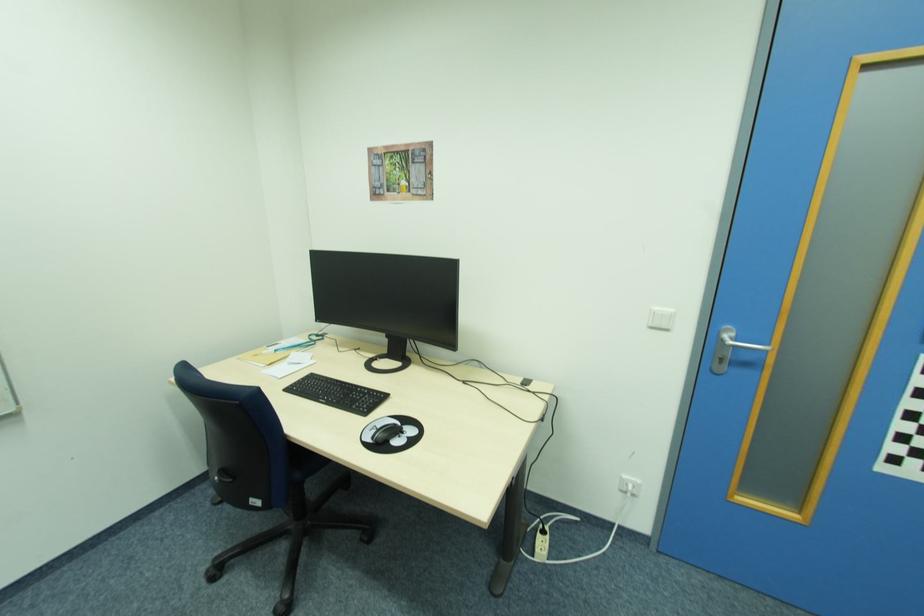
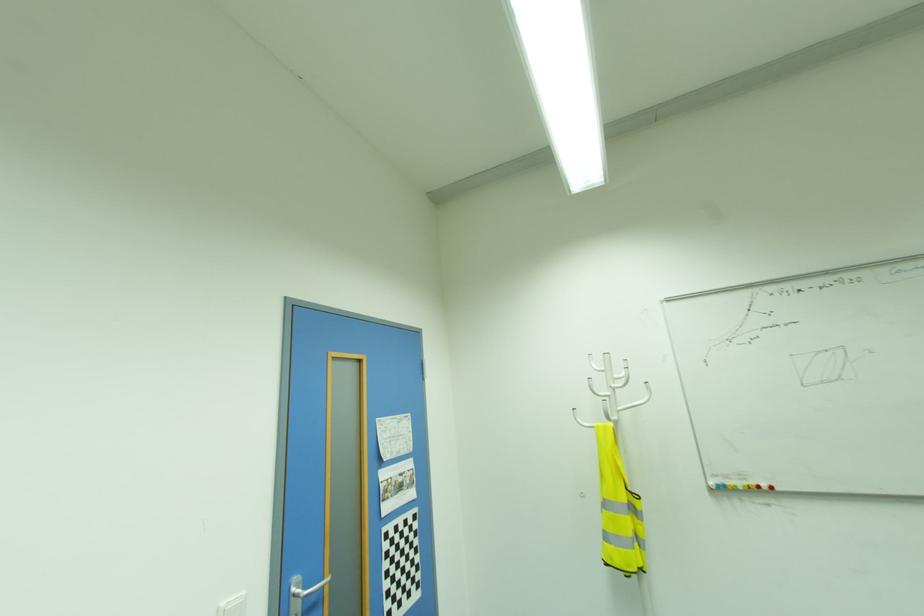
Question: The camera is either moving clockwise (left) or counter-clockwise (right) around the object. The first image is from the beginning of the video and the second image is from the end. Is the camera moving left or right when shooting the video?

Choices:
 (A) Left
 (B) Right

Answer: (A)